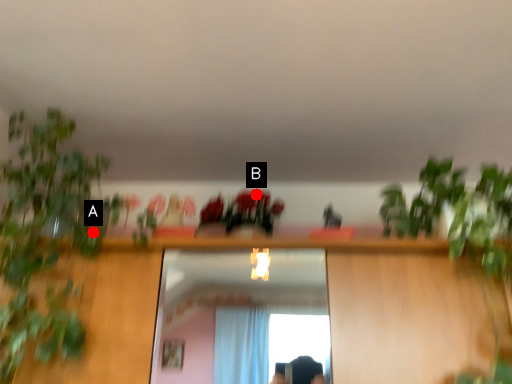
Question: Two points are circled on the image, labeled by A and B beside each circle. Which of the following is the farthest from the observer?

Choices:
 (A) A is further
 (B) B is further

Answer: (B)